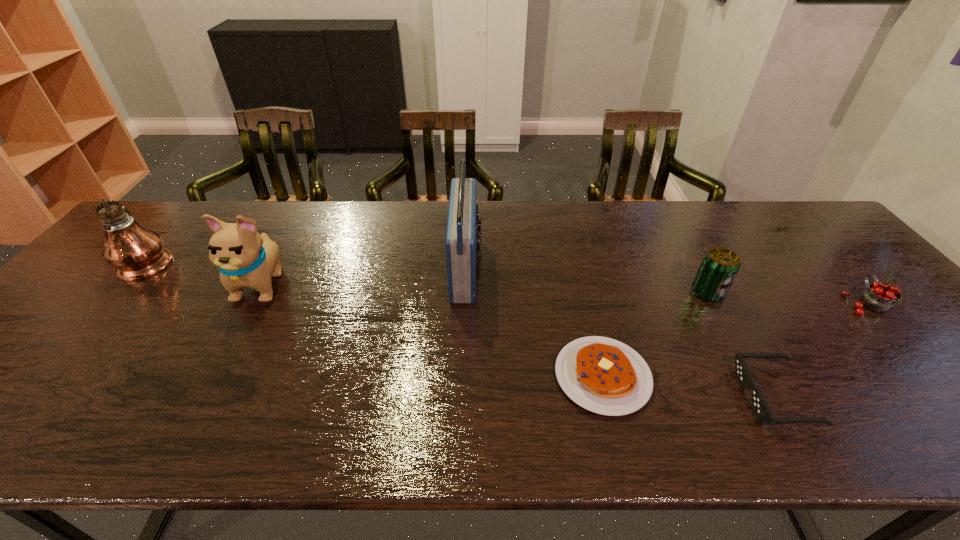
Where is `free space at the far right corner of the desktop`? This screenshot has height=540, width=960. free space at the far right corner of the desktop is located at coordinates (791, 215).

This screenshot has width=960, height=540. In order to click on vacant region between the sixth object from right to left and the fourth object from right to left in this screenshot , I will do `click(433, 329)`.

At what (x,y) coordinates should I click in order to perform the action: click on free space between the sunglasses and the pancake. Please return your answer as a coordinate pair (x, y). This screenshot has width=960, height=540. Looking at the image, I should click on (689, 386).

Locate an element on the screen. empty space between the sunglasses and the fourth object from left to right is located at coordinates (689, 386).

Find the location of `free space that is in between the fourth object from left to right and the leftmost object`. free space that is in between the fourth object from left to right and the leftmost object is located at coordinates (375, 319).

Locate an element on the screen. The image size is (960, 540). vacant area that lies between the second object from left to right and the beer can is located at coordinates (485, 288).

Find the location of a particular element. The image size is (960, 540). free area in between the sunglasses and the pancake is located at coordinates (689, 386).

The height and width of the screenshot is (540, 960). What are the coordinates of `free space between the third shortest object and the fourth tallest object` in the screenshot? It's located at (785, 298).

Identify the location of free space between the cherry and the oil lamp. (506, 282).

Where is `unoccupied area between the second object from left to right and the sunglasses`? This screenshot has height=540, width=960. unoccupied area between the second object from left to right and the sunglasses is located at coordinates (518, 340).